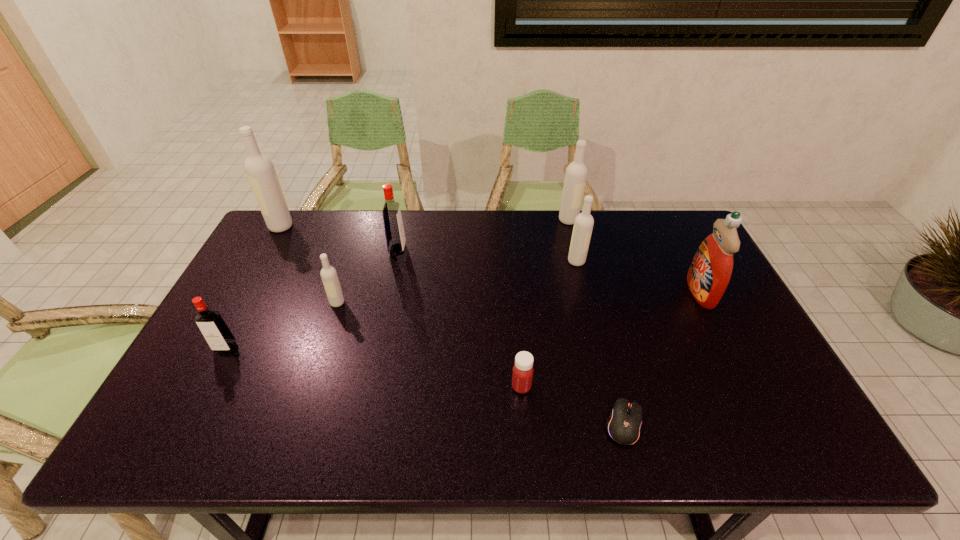
Where is `blank region between the computer mouse and the medicine`? The height and width of the screenshot is (540, 960). blank region between the computer mouse and the medicine is located at coordinates (573, 405).

The image size is (960, 540). Identify the location of empty space that is in between the second tallest vodka and the red medicine. (545, 303).

Find the location of `free space that is in between the computer mouse and the eighth tallest object`. free space that is in between the computer mouse and the eighth tallest object is located at coordinates (573, 405).

You are a GUI agent. You are given a task and a screenshot of the screen. Output one action in this format:
    pyautogui.click(x=<x>, y=<y>)
    Task: Click on the vacant space in between the rightmost object and the second nearest white vodka
    
    Given the screenshot: What is the action you would take?
    pyautogui.click(x=638, y=276)

Find the location of a particular element. This screenshot has height=540, width=960. free space that is in between the eighth farthest object and the bigger red vodka is located at coordinates (460, 318).

Where is `vacant space in between the third biggest white vodka and the fourth object from left to right`? This screenshot has width=960, height=540. vacant space in between the third biggest white vodka and the fourth object from left to right is located at coordinates (487, 255).

Identify which object is located as the sixth nearest to the medicine. Please provide its 2D coordinates. Your answer should be formatted as a tuple, i.e. [(x, y)], where the tuple contains the x and y coordinates of a point satisfying the conditions above.

[(576, 173)]

Select which object is the fourth closest to the second biggest white vodka. Please provide its 2D coordinates. Your answer should be formatted as a tuple, i.e. [(x, y)], where the tuple contains the x and y coordinates of a point satisfying the conditions above.

[(522, 375)]

Find the location of a particular element. vodka identified as the fifth closest to the second nearest white vodka is located at coordinates (219, 337).

Where is `the fifth closest vodka relative to the detergent`? the fifth closest vodka relative to the detergent is located at coordinates (219, 337).